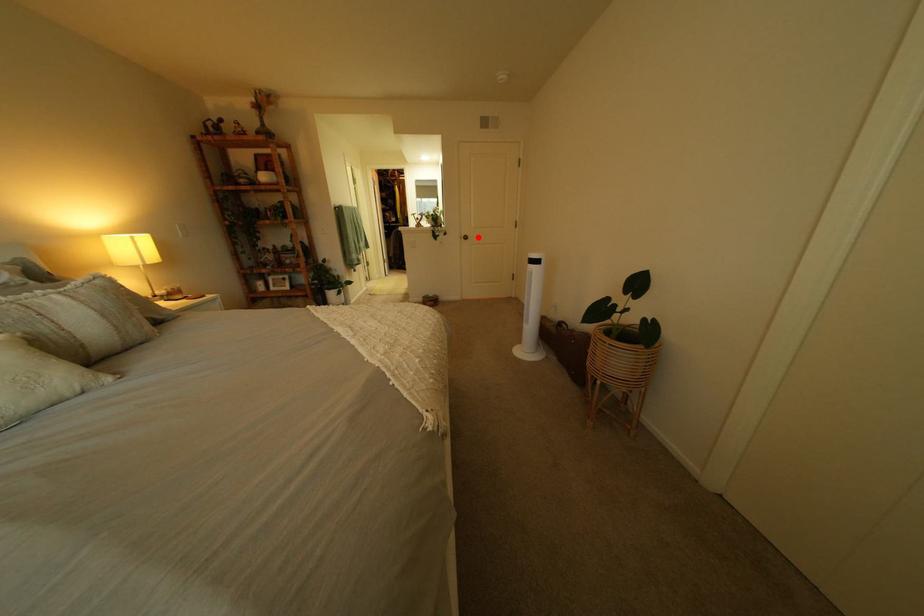
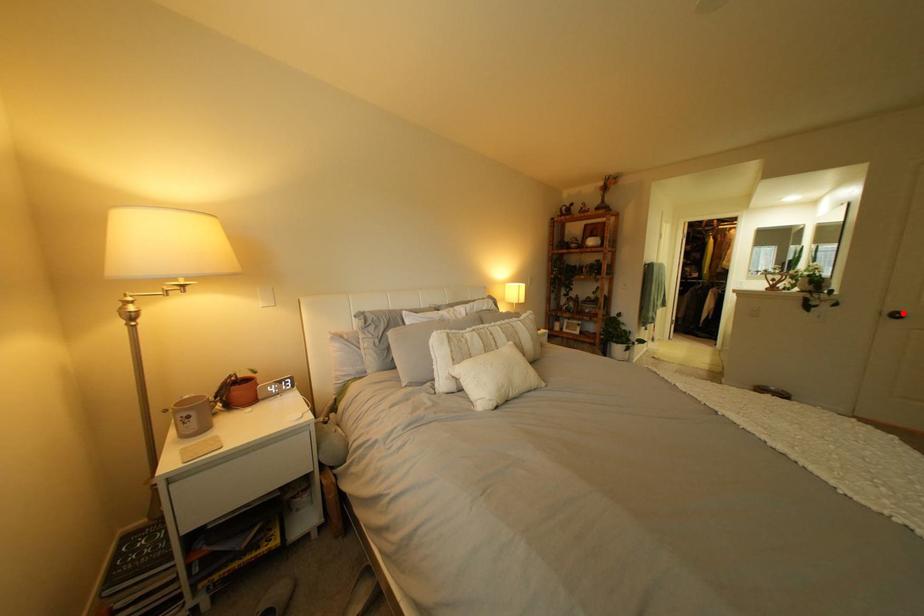
I am providing you with two images of the same scene from different viewpoints. A red point is marked on the first image and another point is marked on the second image. Does the point marked in image1 correspond to the same location as the one in image2?

Yes